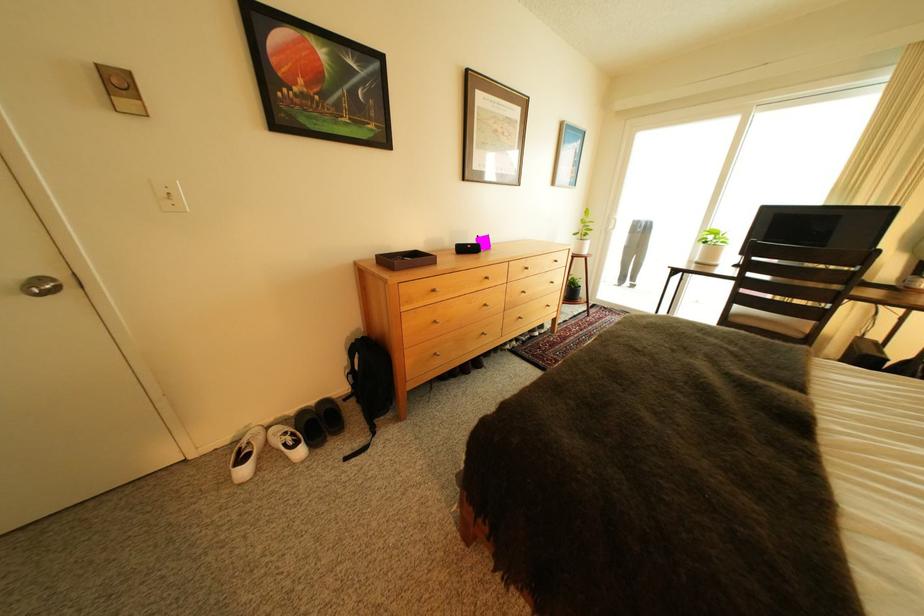
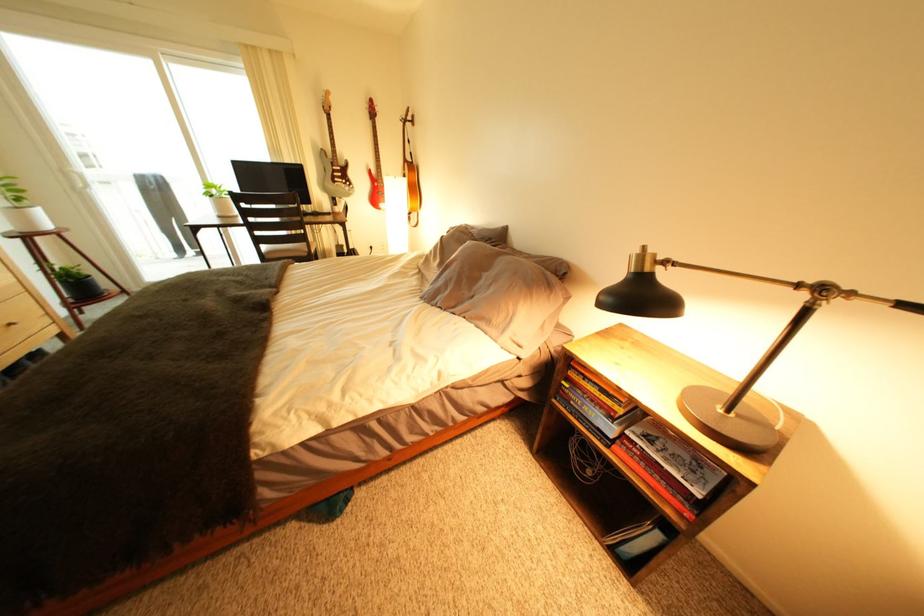
In the second image, find the point that corresponds to [585,288] in the first image.

(83, 282)